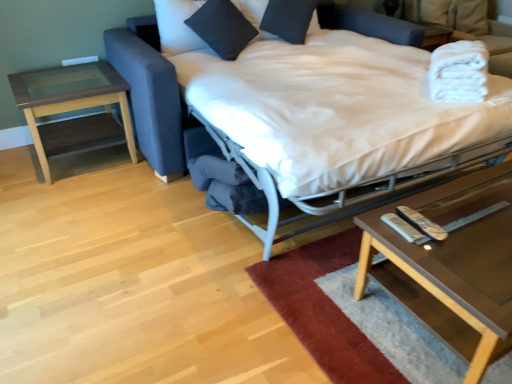
The width and height of the screenshot is (512, 384). Find the location of `free area behind white plastic remote at lower right, the first remote viewed from the left`. free area behind white plastic remote at lower right, the first remote viewed from the left is located at coordinates (398, 203).